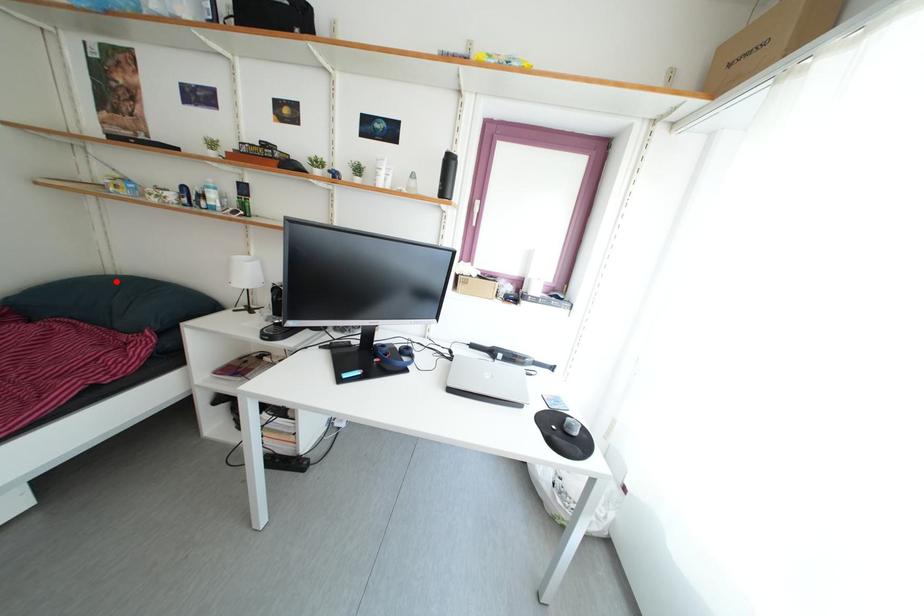
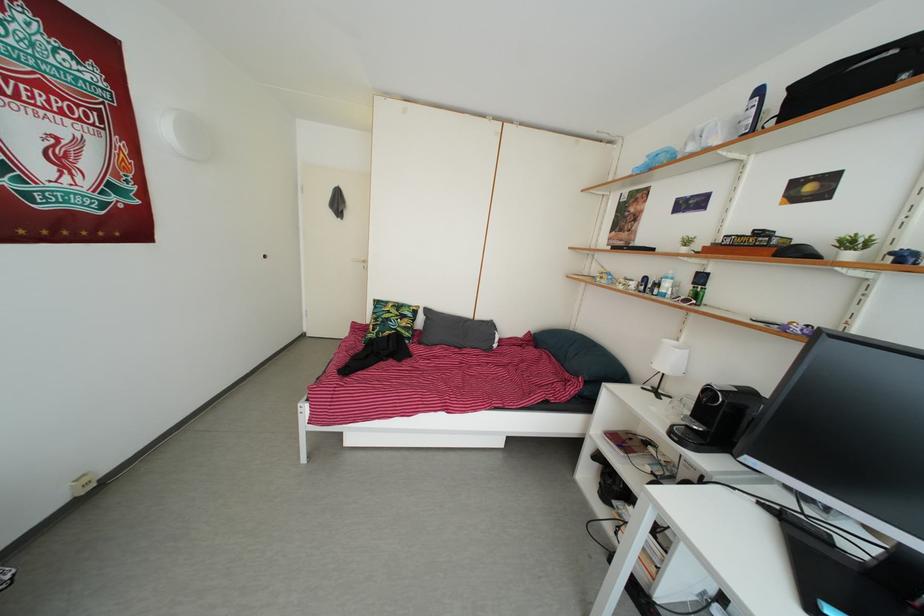
Locate, in the second image, the point that corresponds to the highlighted location in the first image.

(578, 338)